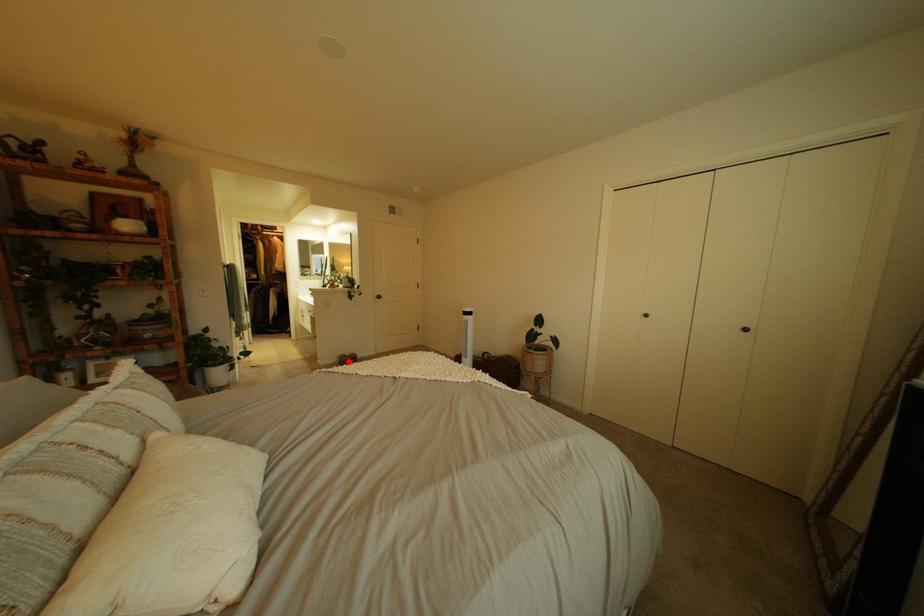
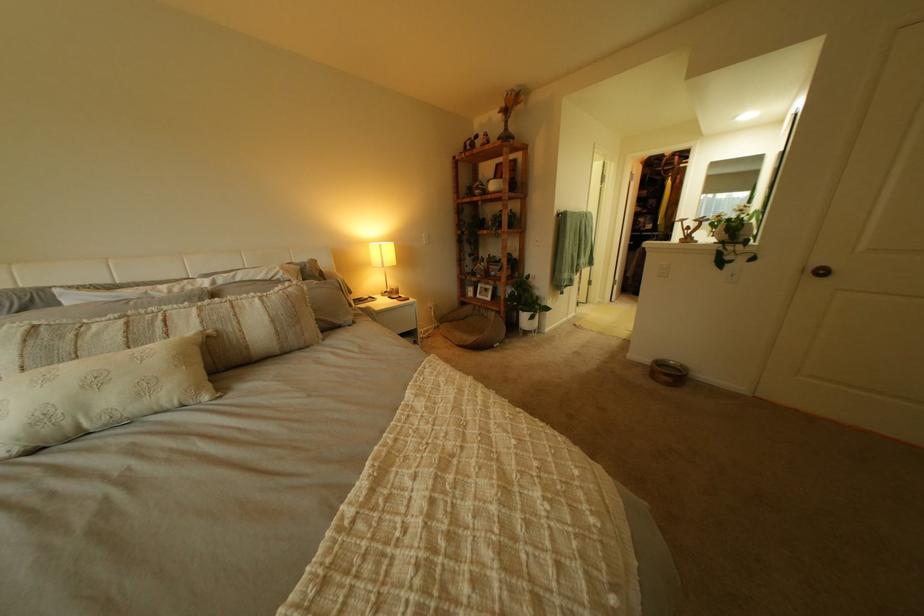
Question: A red point is marked in image1. In image2, is the corresponding 3D point closer to the camera or farther? Reply with the corresponding letter.

Choices:
 (A) The corresponding 3D point is closer.
 (B) The corresponding 3D point is farther.

Answer: (A)